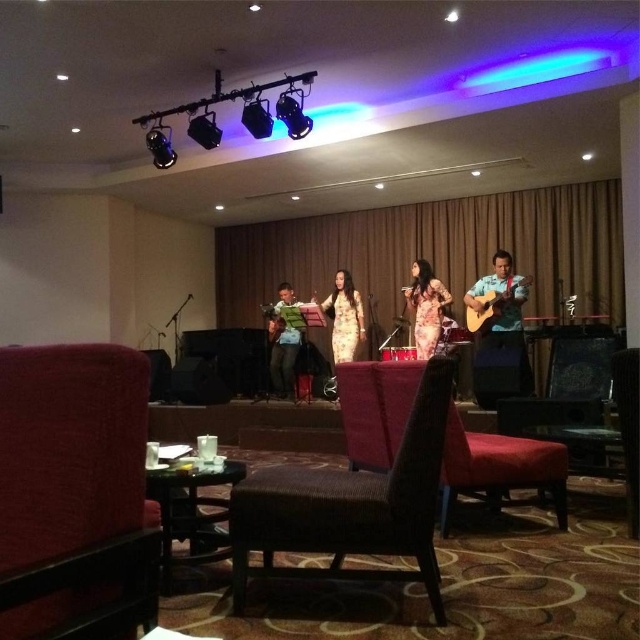
Question: Does wooden acoustic guitar at right come in front of patterned fabric dress at center?

Choices:
 (A) no
 (B) yes

Answer: (B)

Question: Which object is farther from the camera taking this photo?

Choices:
 (A) wooden acoustic guitar at right
 (B) dark brown woven armchair at center
 (C) patterned fabric dress at center
 (D) velvet red armchair at lower left

Answer: (C)

Question: Which object is closer to the camera taking this photo?

Choices:
 (A) yellow satin dress at center
 (B) velvet red armchair at lower left
 (C) acoustic wood guitar at right
 (D) green fabric shirt at center

Answer: (B)

Question: Does velvet red armchair at lower left have a smaller size compared to wooden acoustic guitar at right?

Choices:
 (A) yes
 (B) no

Answer: (A)

Question: Which point is closer to the camera?

Choices:
 (A) patterned fabric dress at center
 (B) acoustic wood guitar at right

Answer: (B)

Question: Does wooden acoustic guitar at right come behind yellow satin dress at center?

Choices:
 (A) no
 (B) yes

Answer: (A)